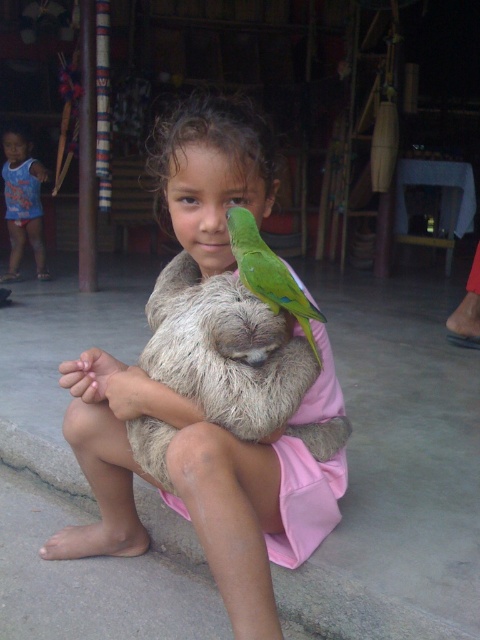
Who is more distant from viewer, (259, 456) or (317, 362)?

The point (317, 362) is behind.

Can you confirm if fuzzy brown sloth at center is smaller than green matte parrot at upper center?

Answer: Incorrect, fuzzy brown sloth at center is not smaller in size than green matte parrot at upper center.

Identify the location of fuzzy brown sloth at center. The height and width of the screenshot is (640, 480). (196, 486).

Which is above, gray concrete curb at lower left or blue cotton shirt at upper left?

Positioned higher is blue cotton shirt at upper left.

Which is in front, point (2, 460) or point (16, 214)?

Point (2, 460)

You are a GUI agent. You are given a task and a screenshot of the screen. Output one action in this format:
    pyautogui.click(x=<x>, y=<y>)
    Task: Click on the gray concrete curb at lower left
    The image size is (480, 640).
    Given the screenshot: What is the action you would take?
    pyautogui.click(x=352, y=608)

Is blue cotton shirt at upper left to the left of green matte parrot at upper center from the viewer's perspective?

Correct, you'll find blue cotton shirt at upper left to the left of green matte parrot at upper center.

Describe the element at coordinates (23, 202) in the screenshot. I see `blue cotton shirt at upper left` at that location.

Is point (7, 200) positioned before point (269, 257)?

No, it is behind (269, 257).

What are the coordinates of `blue cotton shirt at upper left` in the screenshot? It's located at (23, 202).